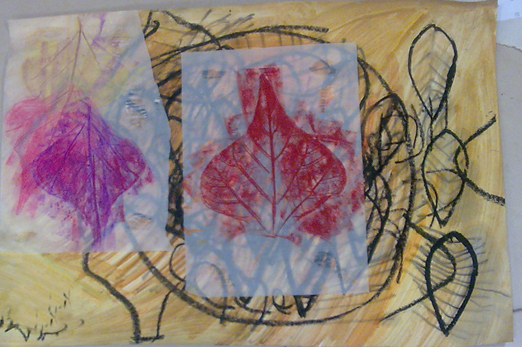
The width and height of the screenshot is (522, 347). Find the location of `white tissue paper`. white tissue paper is located at coordinates (125, 80), (217, 103).